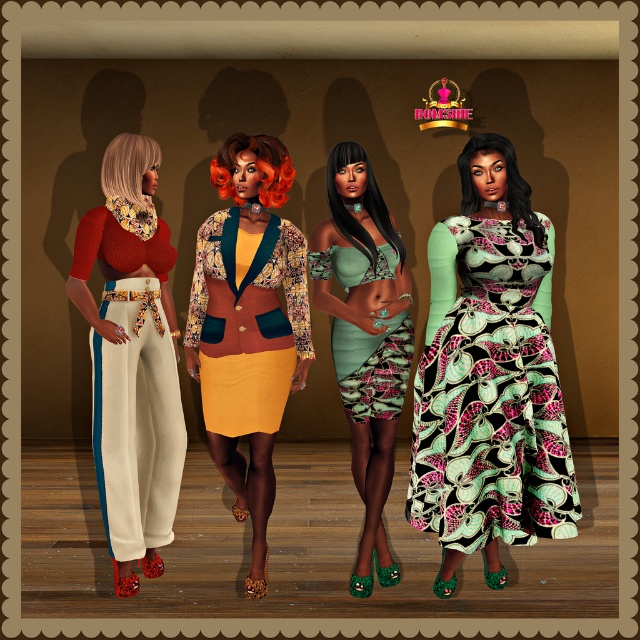
From the picture: You are a photographer setting up a shoot for a fashion magazine. You need to arrange the models so that the wider of the two outfits can be fully captured in the frame. Which model should you position closer to the camera between the matte floral pants at left and the green textured dress at center?

The matte floral pants at left are wider than the green textured dress at center, so you should position the model wearing the matte floral pants at left closer to the camera to ensure the entire outfit is captured in the frame.